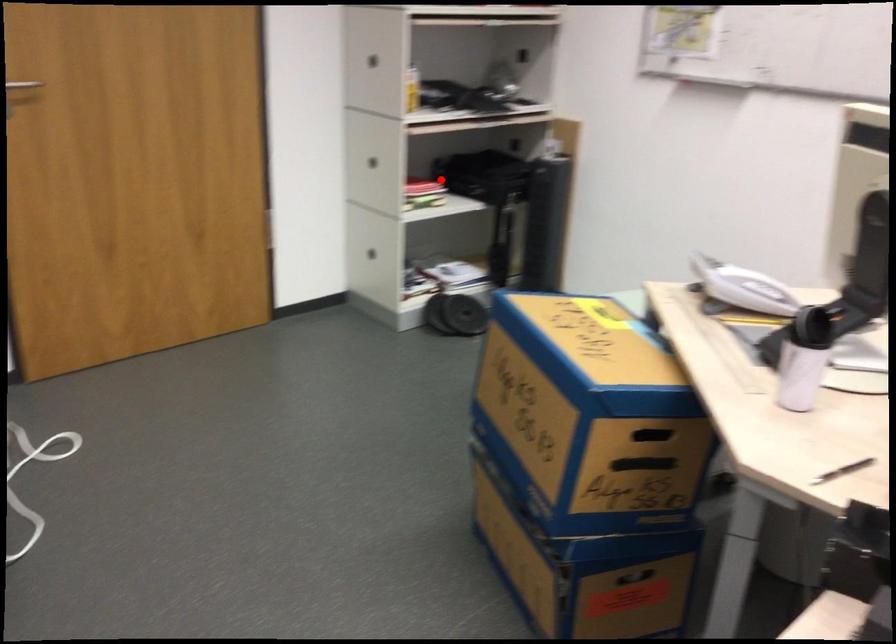
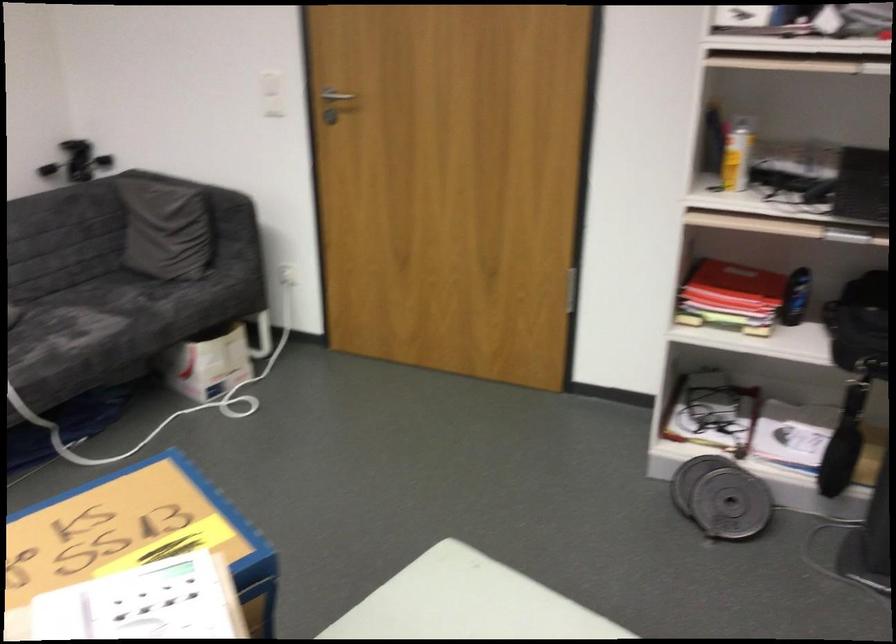
In the second image, find the point that corresponds to the highlighted location in the first image.

(796, 297)